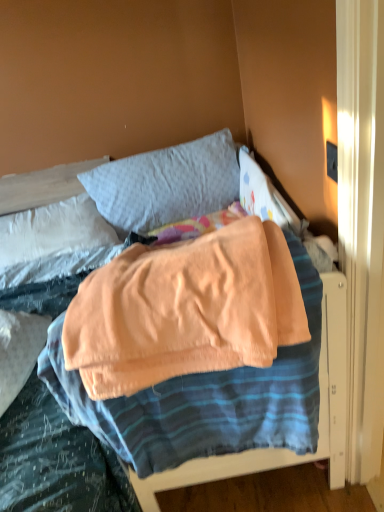
The height and width of the screenshot is (512, 384). I want to click on light gray fabric pillow at upper left, which is the 1th pillow in left-to-right order, so click(53, 231).

Measure the distance between light gray fabric pillow at upper left, which is the 1th pillow in left-to-right order, and camera.

The distance of light gray fabric pillow at upper left, which is the 1th pillow in left-to-right order, from camera is 6.01 feet.

Measure the distance between matte black outlet at upper right and camera.

matte black outlet at upper right is 93.70 centimeters from camera.

The width and height of the screenshot is (384, 512). In order to click on soft peach blanket at center in this screenshot , I will do `click(118, 209)`.

You are a GUI agent. You are given a task and a screenshot of the screen. Output one action in this format:
    pyautogui.click(x=<x>, y=<y>)
    Task: Click on the light gray fabric pillow at upper left, the 2th pillow positioned from the right
    
    Given the screenshot: What is the action you would take?
    pyautogui.click(x=53, y=231)

Considering the points (63, 270) and (16, 257), which point is in front, point (63, 270) or point (16, 257)?

Positioned in front is point (63, 270).

Is soft peach blanket at center not near light gray fabric pillow at upper left, the 2th pillow positioned from the right?

No.

Does soft peach blanket at center have a greater width compared to light gray fabric pillow at upper left, the 2th pillow positioned from the right?

Yes.

From a real-world perspective, which is physically below, soft peach blanket at center or light gray fabric pillow at upper left, which is the 1th pillow in left-to-right order?

light gray fabric pillow at upper left, which is the 1th pillow in left-to-right order, from a real-world perspective.

Is light gray fabric pillow at upper left, which is the 1th pillow in left-to-right order, inside the boundaries of matte black outlet at upper right, or outside?

The correct answer is: outside.

Is light gray fabric pillow at upper left, the 2th pillow positioned from the right, wider or thinner than matte black outlet at upper right?

In the image, light gray fabric pillow at upper left, the 2th pillow positioned from the right, appears to be wider than matte black outlet at upper right.

Which is behind, light gray fabric pillow at upper left, the 2th pillow positioned from the right, or matte black outlet at upper right?

light gray fabric pillow at upper left, the 2th pillow positioned from the right, is more distant.

From the image's perspective, is light gray fabric pillow at upper left, which is the 1th pillow in left-to-right order, under matte black outlet at upper right?

Correct, light gray fabric pillow at upper left, which is the 1th pillow in left-to-right order, appears lower than matte black outlet at upper right in the image.

Is soft peach blanket at center at the back of matte black outlet at upper right?

That's not correct — matte black outlet at upper right is not looking away from soft peach blanket at center.

From the image's perspective, is matte black outlet at upper right above soft peach blanket at center?

Indeed, from the image's perspective, matte black outlet at upper right is shown above soft peach blanket at center.

Considering the sizes of objects matte black outlet at upper right and soft peach blanket at center in the image provided, who is wider, matte black outlet at upper right or soft peach blanket at center?

With larger width is soft peach blanket at center.

You are a GUI agent. You are given a task and a screenshot of the screen. Output one action in this format:
    pyautogui.click(x=<x>, y=<y>)
    Task: Click on the bed below the matte black outlet at upper right (from the image's perspective)
    The width and height of the screenshot is (384, 512).
    Given the screenshot: What is the action you would take?
    pyautogui.click(x=118, y=209)

Does light gray fabric pillow at upper left, the 2th pillow positioned from the right, turn towards soft peach blanket at center?

Yes, light gray fabric pillow at upper left, the 2th pillow positioned from the right, is facing soft peach blanket at center.

Between light gray fabric pillow at upper left, which is the 1th pillow in left-to-right order, and soft peach blanket at center, which one has smaller width?

With smaller width is light gray fabric pillow at upper left, which is the 1th pillow in left-to-right order.

The height and width of the screenshot is (512, 384). Identify the location of bed that is on the right side of light gray fabric pillow at upper left, the 2th pillow positioned from the right. (118, 209).

Is point (102, 498) less distant than point (103, 193)?

That is True.

Consider the image. From the image's perspective, is soft peach blanket at center located above gray cotton pillow at upper center, which is counted as the second pillow, starting from the left?

Incorrect, from the image's perspective, soft peach blanket at center is lower than gray cotton pillow at upper center, which is counted as the second pillow, starting from the left.

In the image, is soft peach blanket at center on the left side or the right side of gray cotton pillow at upper center, which is counted as the second pillow, starting from the left?

From the image, it's evident that soft peach blanket at center is to the right of gray cotton pillow at upper center, which is counted as the second pillow, starting from the left.

Based on the photo, does matte black outlet at upper right have a lesser height compared to gray cotton pillow at upper center, which is counted as the second pillow, starting from the left?

Yes.

Considering the points (327, 166) and (106, 177), which point is in front, point (327, 166) or point (106, 177)?

The point (327, 166) is closer to the camera.

Is matte black outlet at upper right not near gray cotton pillow at upper center, which is counted as the second pillow, starting from the left?

Indeed, matte black outlet at upper right is not near gray cotton pillow at upper center, which is counted as the second pillow, starting from the left.

Measure the distance between matte black outlet at upper right and gray cotton pillow at upper center, which is counted as the second pillow, starting from the left.

The distance of matte black outlet at upper right from gray cotton pillow at upper center, which is counted as the second pillow, starting from the left, is 1.03 meters.

Is soft peach blanket at center completely or partially outside of matte black outlet at upper right?

soft peach blanket at center is positioned outside matte black outlet at upper right.

In the scene shown: Is soft peach blanket at center oriented towards matte black outlet at upper right?

No, soft peach blanket at center is not facing towards matte black outlet at upper right.

From the image's perspective, which is above, soft peach blanket at center or matte black outlet at upper right?

From the image's view, matte black outlet at upper right is above.

Who is smaller, soft peach blanket at center or matte black outlet at upper right?

With smaller size is matte black outlet at upper right.

Find the location of a particular element. The image size is (384, 512). bed located on the right of light gray fabric pillow at upper left, the 2th pillow positioned from the right is located at coordinates (118, 209).

You are a GUI agent. You are given a task and a screenshot of the screen. Output one action in this format:
    pyautogui.click(x=<x>, y=<y>)
    Task: Click on the electric outlet above the light gray fabric pillow at upper left, which is the 1th pillow in left-to-right order (from the image's perspective)
    Image resolution: width=384 pixels, height=512 pixels.
    Given the screenshot: What is the action you would take?
    pyautogui.click(x=332, y=161)

Estimate the real-world distances between objects in this image. Which object is further from matte black outlet at upper right, soft peach blanket at center or light gray fabric pillow at upper left, which is the 1th pillow in left-to-right order?

Based on the image, light gray fabric pillow at upper left, which is the 1th pillow in left-to-right order, appears to be further to matte black outlet at upper right.

Based on their spatial positions, is light gray fabric pillow at upper left, the 2th pillow positioned from the right, or matte black outlet at upper right further from gray cotton pillow at upper center, which is counted as the first pillow, starting from the right?

matte black outlet at upper right.

Based on their spatial positions, is soft peach blanket at center or gray cotton pillow at upper center, which is counted as the first pillow, starting from the right, closer to light gray fabric pillow at upper left, which is the 1th pillow in left-to-right order?

soft peach blanket at center is closer to light gray fabric pillow at upper left, which is the 1th pillow in left-to-right order.

Considering their positions, is matte black outlet at upper right positioned further to soft peach blanket at center than gray cotton pillow at upper center, which is counted as the second pillow, starting from the left?

The object further to soft peach blanket at center is matte black outlet at upper right.

Estimate the real-world distances between objects in this image. Which object is closer to soft peach blanket at center, gray cotton pillow at upper center, which is counted as the first pillow, starting from the right, or light gray fabric pillow at upper left, which is the 1th pillow in left-to-right order?

gray cotton pillow at upper center, which is counted as the first pillow, starting from the right, is positioned closer to the anchor soft peach blanket at center.

Which object lies further to the anchor point light gray fabric pillow at upper left, the 2th pillow positioned from the right, gray cotton pillow at upper center, which is counted as the first pillow, starting from the right, or soft peach blanket at center?

gray cotton pillow at upper center, which is counted as the first pillow, starting from the right, is further to light gray fabric pillow at upper left, the 2th pillow positioned from the right.

Considering their positions, is gray cotton pillow at upper center, which is counted as the second pillow, starting from the left, positioned closer to matte black outlet at upper right than light gray fabric pillow at upper left, the 2th pillow positioned from the right?

gray cotton pillow at upper center, which is counted as the second pillow, starting from the left.

Which object lies further to the anchor point gray cotton pillow at upper center, which is counted as the first pillow, starting from the right, matte black outlet at upper right or soft peach blanket at center?

matte black outlet at upper right is further to gray cotton pillow at upper center, which is counted as the first pillow, starting from the right.

Where is `pillow between soft peach blanket at center and light gray fabric pillow at upper left, the 2th pillow positioned from the right, from front to back`? pillow between soft peach blanket at center and light gray fabric pillow at upper left, the 2th pillow positioned from the right, from front to back is located at coordinates (166, 184).

This screenshot has height=512, width=384. I want to click on electric outlet located between soft peach blanket at center and gray cotton pillow at upper center, which is counted as the first pillow, starting from the right, in the depth direction, so click(x=332, y=161).

The height and width of the screenshot is (512, 384). What are the coordinates of `electric outlet positioned between soft peach blanket at center and light gray fabric pillow at upper left, the 2th pillow positioned from the right, from near to far` in the screenshot? It's located at (332, 161).

Find the location of a particular element. This screenshot has width=384, height=512. pillow between matte black outlet at upper right and light gray fabric pillow at upper left, which is the 1th pillow in left-to-right order, in the front-back direction is located at coordinates (166, 184).